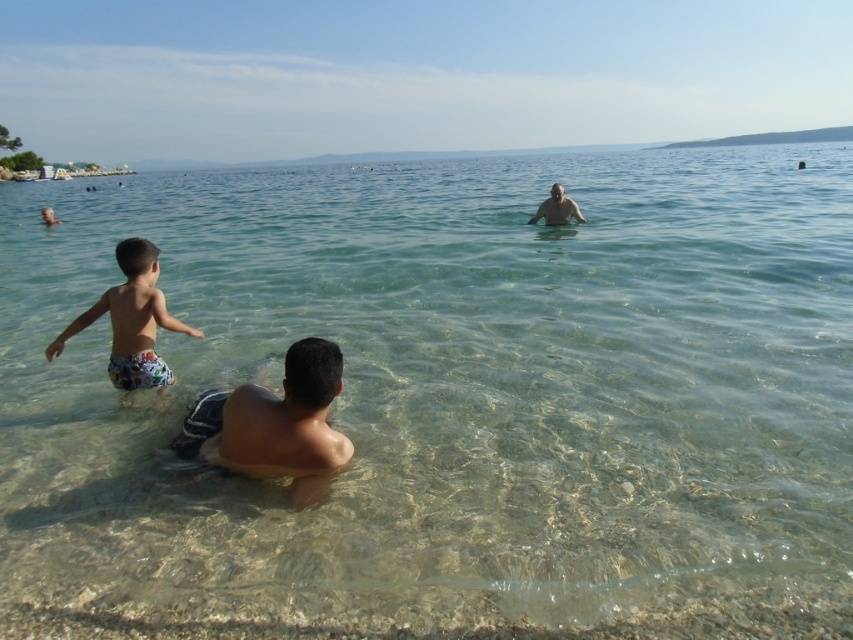
Question: Based on their relative distances, which object is nearer to the printed swim trunks at left?

Choices:
 (A) smooth skin man at upper center
 (B) light brown skin at center

Answer: (B)

Question: Is light brown skin at center smaller than printed swim trunks at left?

Choices:
 (A) no
 (B) yes

Answer: (A)

Question: Which object is closer to the camera taking this photo?

Choices:
 (A) smooth skin man at upper center
 (B) light brown skin at center

Answer: (B)

Question: Is printed swim trunks at left thinner than smooth skin man at upper center?

Choices:
 (A) no
 (B) yes

Answer: (A)

Question: Is printed swim trunks at left below smooth skin man at upper center?

Choices:
 (A) yes
 (B) no

Answer: (A)

Question: Which point is farther from the camera taking this photo?

Choices:
 (A) (201, 432)
 (B) (555, 221)

Answer: (B)